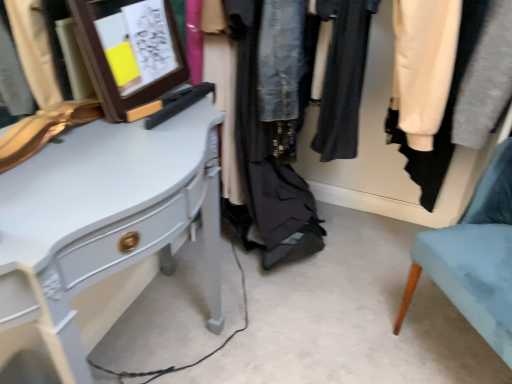
Question: Is wooden frame at upper left to the left of light blue fabric chair at lower right from the viewer's perspective?

Choices:
 (A) yes
 (B) no

Answer: (A)

Question: From a real-world perspective, does wooden frame at upper left sit lower than light blue fabric chair at lower right?

Choices:
 (A) no
 (B) yes

Answer: (A)

Question: Is wooden frame at upper left shorter than light blue fabric chair at lower right?

Choices:
 (A) yes
 (B) no

Answer: (A)

Question: Is wooden frame at upper left turned away from light blue fabric chair at lower right?

Choices:
 (A) yes
 (B) no

Answer: (B)

Question: From the image's perspective, is wooden frame at upper left under light blue fabric chair at lower right?

Choices:
 (A) no
 (B) yes

Answer: (A)

Question: Is denim jacket at center situated inside white glossy desk at left or outside?

Choices:
 (A) outside
 (B) inside

Answer: (A)

Question: From a real-world perspective, is denim jacket at center above or below white glossy desk at left?

Choices:
 (A) below
 (B) above

Answer: (B)

Question: Is denim jacket at center taller or shorter than white glossy desk at left?

Choices:
 (A) tall
 (B) short

Answer: (B)

Question: Is denim jacket at center wider or thinner than white glossy desk at left?

Choices:
 (A) thin
 (B) wide

Answer: (B)

Question: Is white glossy desk at left inside or outside of light blue fabric chair at lower right?

Choices:
 (A) inside
 (B) outside

Answer: (B)

Question: Visually, is white glossy desk at left positioned to the left or to the right of light blue fabric chair at lower right?

Choices:
 (A) left
 (B) right

Answer: (A)

Question: From the image's perspective, is white glossy desk at left above or below light blue fabric chair at lower right?

Choices:
 (A) above
 (B) below

Answer: (A)

Question: In terms of height, does white glossy desk at left look taller or shorter compared to light blue fabric chair at lower right?

Choices:
 (A) tall
 (B) short

Answer: (A)

Question: From a real-world perspective, is light blue fabric chair at lower right above or below wooden frame at upper left?

Choices:
 (A) above
 (B) below

Answer: (B)

Question: Is light blue fabric chair at lower right spatially inside wooden frame at upper left, or outside of it?

Choices:
 (A) inside
 (B) outside

Answer: (B)